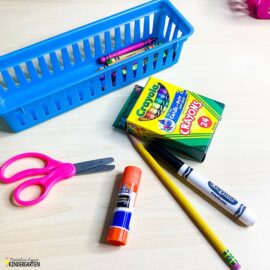
At what (x,y) coordinates should I click in order to perform the action: click on blue plastic storage basket. Please return your answer as a coordinate pair (x, y). Looking at the image, I should click on point(50,45).